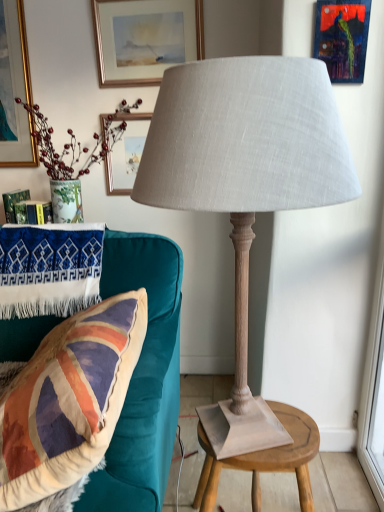
Question: Is matte gold picture frame at upper center, which is counted as the first picture frame, starting from the top, taller or shorter than velvet union jack pillow at left?

Choices:
 (A) short
 (B) tall

Answer: (A)

Question: From a real-world perspective, is matte gold picture frame at upper center, placed as the 2th picture frame when sorted from bottom to top, physically located above or below velvet union jack pillow at left?

Choices:
 (A) above
 (B) below

Answer: (A)

Question: Estimate the real-world distances between objects in this image. Which object is closer to the matte gold picture frame at upper center, placed as the 2th picture frame when sorted from bottom to top?

Choices:
 (A) transparent glass window screen at right
 (B) matte gray fabric lamp at center
 (C) wooden stool at center
 (D) metallic blue painting at upper right, which ranks as the first picture frame in right-to-left order
 (E) velvet union jack pillow at left

Answer: (D)

Question: Which of these objects is positioned closest to the wooden stool at center?

Choices:
 (A) transparent glass window screen at right
 (B) velvet union jack pillow at left
 (C) matte gray fabric lamp at center
 (D) metallic blue painting at upper right, marked as the 2th picture frame in a back-to-front arrangement
 (E) matte gold picture frame at upper center, placed as the 2th picture frame when sorted from front to back

Answer: (B)